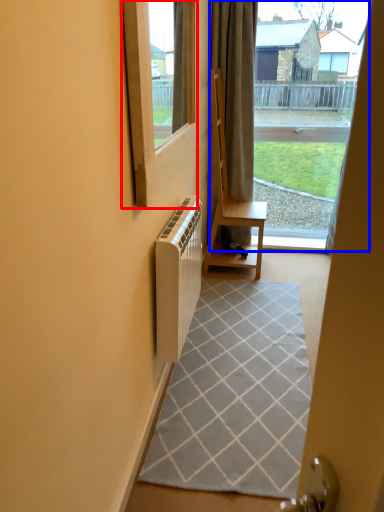
Question: Which object is closer to the camera taking this photo, window (highlighted by a red box) or bay window (highlighted by a blue box)?

Choices:
 (A) window
 (B) bay window

Answer: (A)